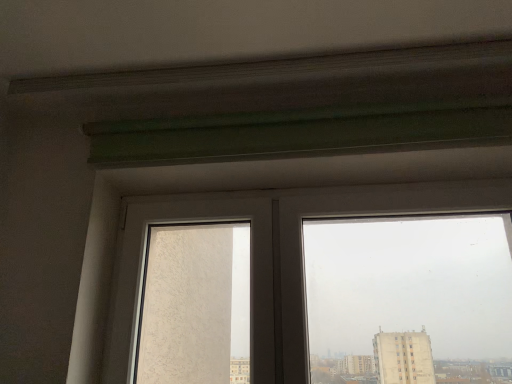
Identify the location of transparent glass window at center. (272, 255).

The height and width of the screenshot is (384, 512). What do you see at coordinates (272, 255) in the screenshot? I see `transparent glass window at center` at bounding box center [272, 255].

In order to face transparent glass window at center, should I rotate leftwards or rightwards?

Turn right by 8.100 degrees to look at transparent glass window at center.

Locate an element on the screen. transparent glass window at center is located at coordinates (272, 255).